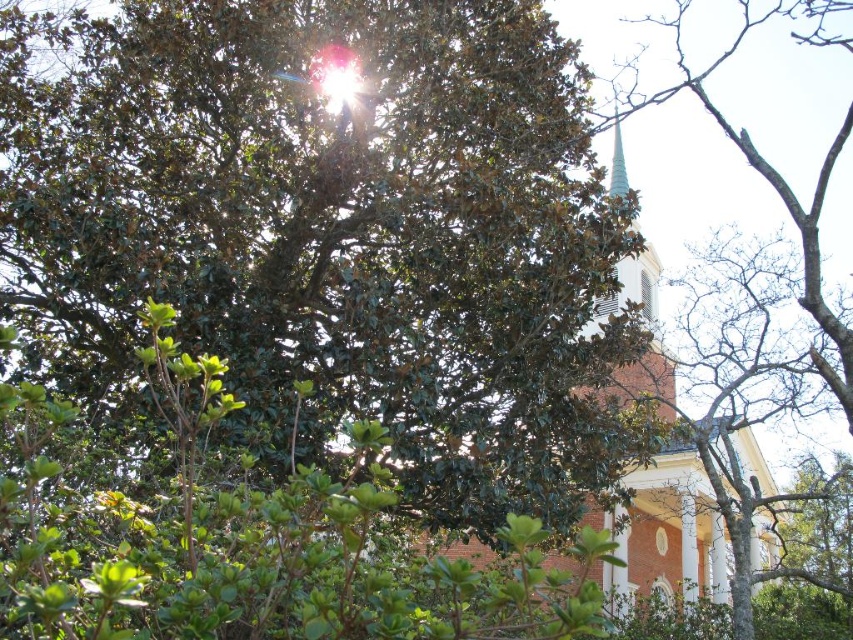
Is white brick church at center smaller than green glass spire at upper center?

No.

The height and width of the screenshot is (640, 853). Describe the element at coordinates (668, 529) in the screenshot. I see `white brick church at center` at that location.

Between point (635, 362) and point (619, 161), which one is positioned behind?

The point (619, 161) is behind.

You are a GUI agent. You are given a task and a screenshot of the screen. Output one action in this format:
    pyautogui.click(x=<x>, y=<y>)
    Task: Click on the white brick church at center
    Image resolution: width=853 pixels, height=640 pixels.
    Given the screenshot: What is the action you would take?
    pyautogui.click(x=668, y=529)

Between white brick church at center and green leafy tree at upper right, which one appears on the right side from the viewer's perspective?

green leafy tree at upper right

Consider the image. Can you confirm if white brick church at center is wider than green leafy tree at upper right?

In fact, white brick church at center might be narrower than green leafy tree at upper right.

Is point (671, 540) behind point (677, 0)?

No, it is in front of (677, 0).

Image resolution: width=853 pixels, height=640 pixels. Find the location of `white brick church at center`. white brick church at center is located at coordinates (668, 529).

Based on the photo, is green leafy tree at upper right bigger than green glass spire at upper center?

Yes, green leafy tree at upper right is bigger than green glass spire at upper center.

Is green leafy tree at upper right behind green glass spire at upper center?

No, it is not.

You are a GUI agent. You are given a task and a screenshot of the screen. Output one action in this format:
    pyautogui.click(x=<x>, y=<y>)
    Task: Click on the green leafy tree at upper right
    The height and width of the screenshot is (640, 853).
    Given the screenshot: What is the action you would take?
    pyautogui.click(x=776, y=170)